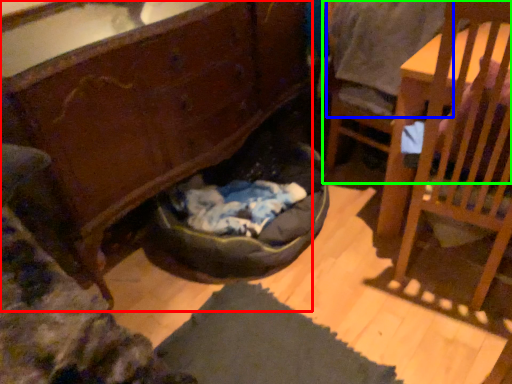
Question: Based on their relative distances, which object is nearer to cabinetry (highlighted by a red box)? Choose from clothing (highlighted by a blue box) and chair (highlighted by a green box).

Choices:
 (A) clothing
 (B) chair

Answer: (A)